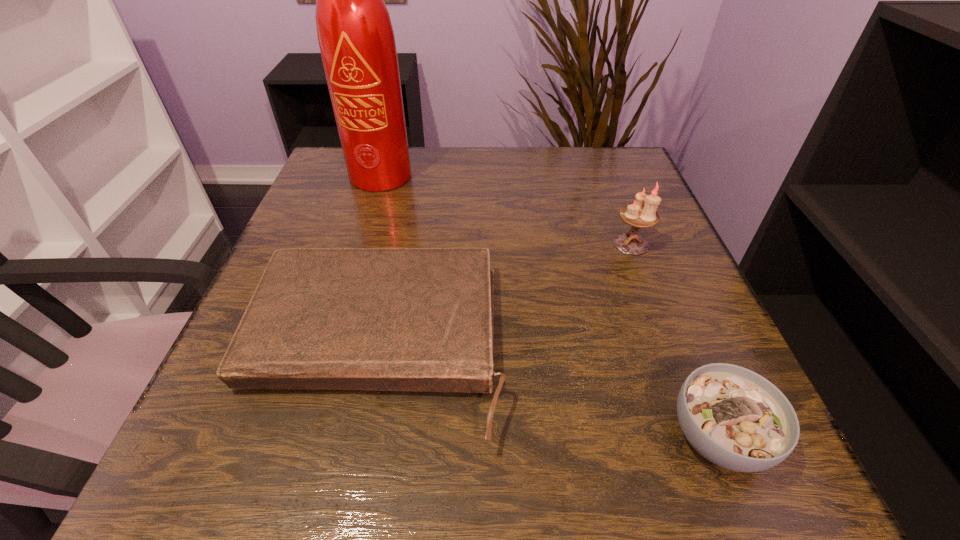
Where is `the farthest object`? the farthest object is located at coordinates (355, 34).

Where is `fire extinguisher`? The height and width of the screenshot is (540, 960). fire extinguisher is located at coordinates (355, 34).

You are a GUI agent. You are given a task and a screenshot of the screen. Output one action in this format:
    pyautogui.click(x=<x>, y=<y>)
    Task: Click on the candle holder
    This screenshot has height=540, width=960.
    Given the screenshot: What is the action you would take?
    pyautogui.click(x=637, y=215)

Find the location of `the third shortest object`. the third shortest object is located at coordinates (637, 215).

Where is `the third tallest object`? The width and height of the screenshot is (960, 540). the third tallest object is located at coordinates (735, 418).

Where is `the shortest object`? The width and height of the screenshot is (960, 540). the shortest object is located at coordinates (384, 319).

Identify the location of vacant space located 0.170m on the right of the farthest object. (497, 176).

Locate an element on the screen. free space located 0.160m on the front of the third shortest object is located at coordinates (660, 318).

Image resolution: width=960 pixels, height=540 pixels. I want to click on free space located 0.090m on the back of the third tallest object, so click(680, 343).

Where is `vacant region located 0.050m on the spine side of the shortest object`? The image size is (960, 540). vacant region located 0.050m on the spine side of the shortest object is located at coordinates (345, 497).